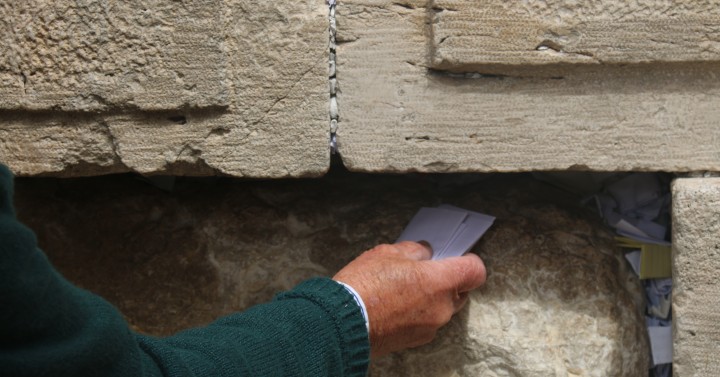
The width and height of the screenshot is (720, 377). I want to click on upper wall structure, so click(255, 90), click(382, 96).